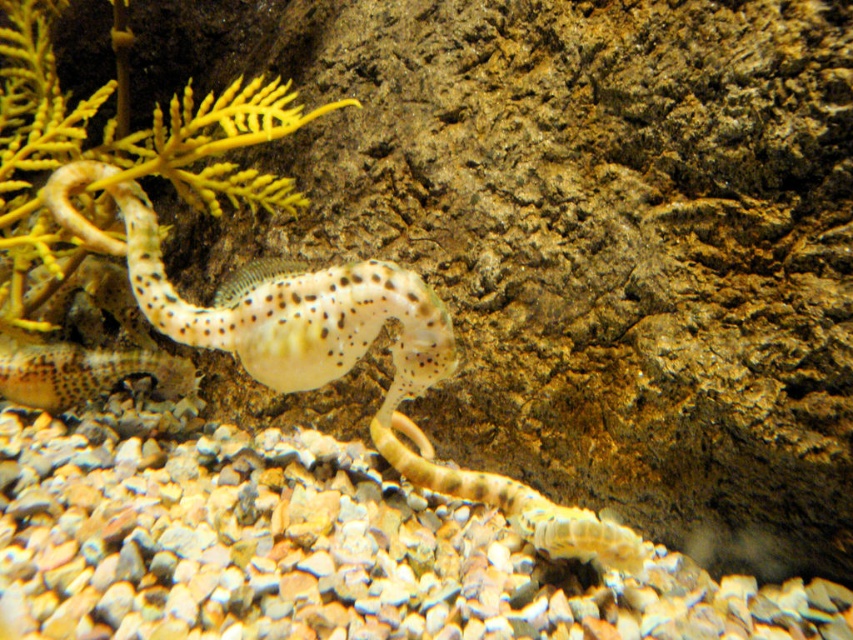
Is yellow leafy plant at upper left positioned at the back of speckled translucent seahorse at center?

Yes, it is behind speckled translucent seahorse at center.

You are a GUI agent. You are given a task and a screenshot of the screen. Output one action in this format:
    pyautogui.click(x=<x>, y=<y>)
    Task: Click on the yellow leafy plant at upper left
    
    Given the screenshot: What is the action you would take?
    pyautogui.click(x=120, y=179)

Is speckled translucent gecko at center shorter than yellow leafy plant at upper left?

Yes.

From the picture: Is speckled translucent gecko at center above yellow leafy plant at upper left?

Incorrect, speckled translucent gecko at center is not positioned above yellow leafy plant at upper left.

This screenshot has height=640, width=853. What are the coordinates of `speckled translucent gecko at center` in the screenshot? It's located at coord(334,353).

Can you confirm if speckled translucent gecko at center is shorter than speckled translucent seahorse at center?

No.

Does speckled translucent gecko at center have a smaller size compared to speckled translucent seahorse at center?

Incorrect, speckled translucent gecko at center is not smaller in size than speckled translucent seahorse at center.

Describe the element at coordinates (334, 353) in the screenshot. I see `speckled translucent gecko at center` at that location.

This screenshot has height=640, width=853. Find the location of `speckled translucent gecko at center`. speckled translucent gecko at center is located at coordinates (334, 353).